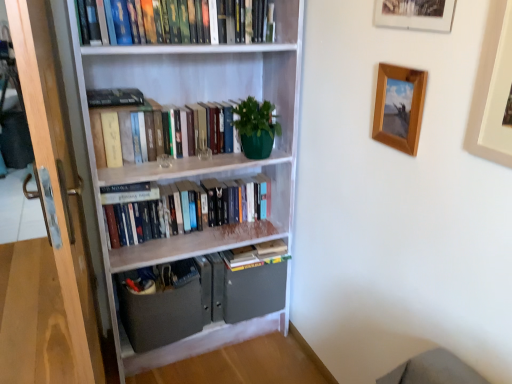
Question: From a real-world perspective, is wooden screen door at left above or below hardcover books at center, arranged as the 3th book when viewed from the top?

Choices:
 (A) above
 (B) below

Answer: (A)

Question: Do you think wooden screen door at left is within hardcover books at center, which is the second book in bottom-to-top order, or outside of it?

Choices:
 (A) outside
 (B) inside

Answer: (A)

Question: Estimate the real-world distances between objects in this image. Which object is closer to the wooden picture frame at upper right, arranged as the third picture frame when viewed from the right?

Choices:
 (A) hardcover books at center, which is the second book in bottom-to-top order
 (B) wooden screen door at left
 (C) wooden picture frame at upper center, the second picture frame viewed from the right
 (D) hardcover books at center, which appears as the third book when ordered from the bottom
 (E) hardcover books at center, marked as the 4th book in a top-to-bottom arrangement

Answer: (C)

Question: Estimate the real-world distances between objects in this image. Which object is closer to the wooden screen door at left?

Choices:
 (A) wooden picture frame at upper right, which ranks as the first picture frame in right-to-left order
 (B) wooden picture frame at upper right, arranged as the third picture frame when viewed from the right
 (C) hardcover books at upper center, which is counted as the first book, starting from the top
 (D) wooden picture frame at upper center, the second picture frame viewed from the right
 (E) hardcover books at center, the 1th book positioned from the bottom

Answer: (C)